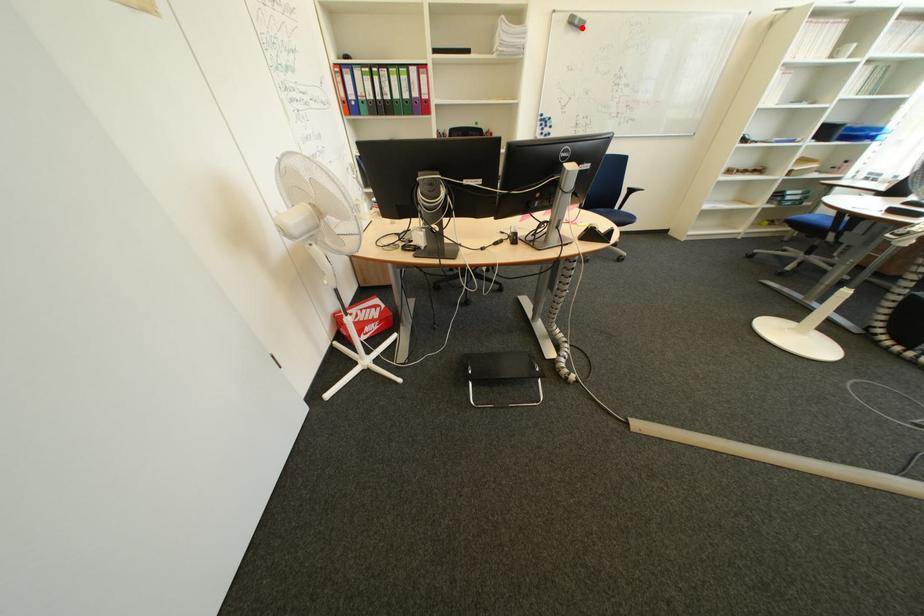
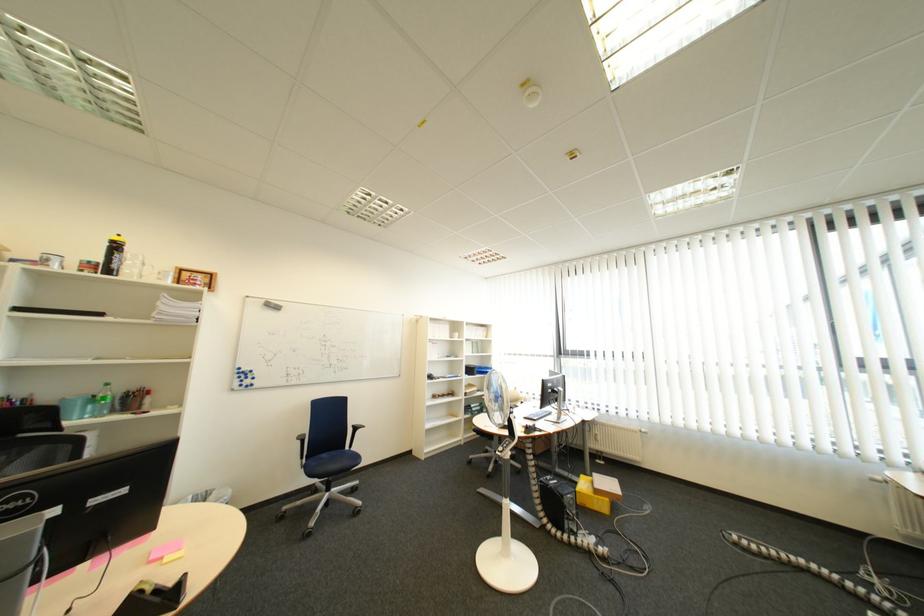
Locate, in the second image, the point that corresponds to the highlighted location in the first image.

(277, 309)